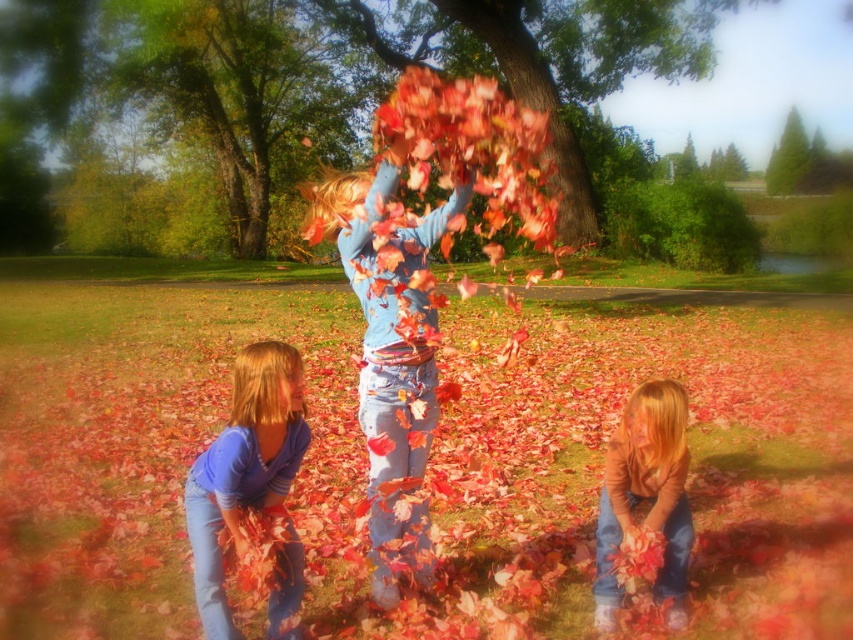
Question: Does green leafy tree at upper center have a lesser width compared to matte blue shirt at center?

Choices:
 (A) yes
 (B) no

Answer: (B)

Question: Which object is positioned farthest from the blue cotton shirt at lower left?

Choices:
 (A) smooth bark tree at center
 (B) matte brown sweater at lower right
 (C) green textured tree at upper right

Answer: (C)

Question: Can you confirm if green leafy tree at upper center is positioned above smooth bark tree at center?

Choices:
 (A) no
 (B) yes

Answer: (A)

Question: From the image, what is the correct spatial relationship of smooth bark tree at center in relation to blue cotton shirt at lower left?

Choices:
 (A) below
 (B) above

Answer: (B)

Question: Which point appears closest to the camera in this image?

Choices:
 (A) (329, 106)
 (B) (618, 54)

Answer: (B)

Question: Estimate the real-world distances between objects in this image. Which object is farther from the smooth bark tree at center?

Choices:
 (A) green leafy tree at upper center
 (B) green textured tree at upper right
 (C) matte blue shirt at center

Answer: (B)